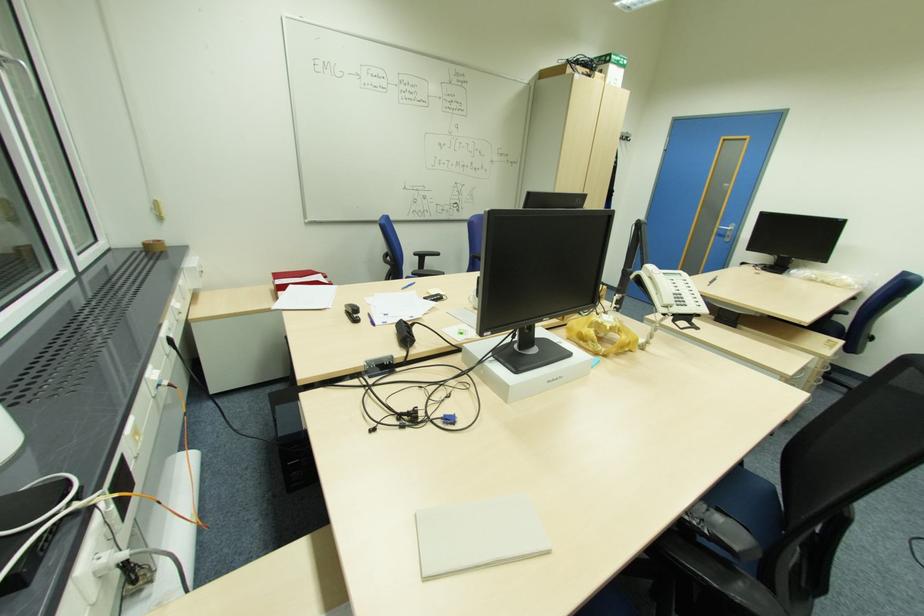
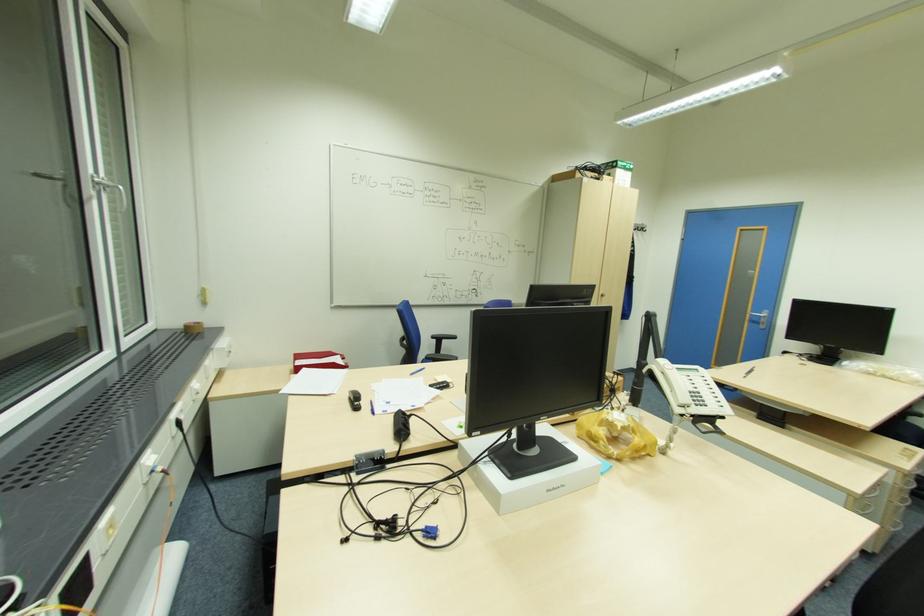
Where in the second image is the point corresponding to the point at 320,273 from the first image?

(338, 354)